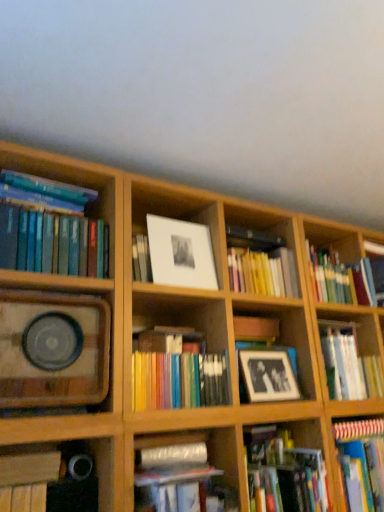
Question: Do you think matte black frame at center, the second shelf viewed from the left, is within yellow matte book at center, which is counted as the 3th book, starting from the right, or outside of it?

Choices:
 (A) inside
 (B) outside

Answer: (B)

Question: Visually, is matte black frame at center, the first shelf positioned from the right, positioned to the left or to the right of yellow matte book at center, which is counted as the 3th book, starting from the right?

Choices:
 (A) right
 (B) left

Answer: (A)

Question: Considering the real-world distances, which object is closest to the black matte picture frame at center, the second picture frame positioned from the left?

Choices:
 (A) wooden speaker at left, marked as the 2th shelf in a right-to-left arrangement
 (B) yellow matte book at center, which is counted as the 3th book, starting from the right
 (C) hardcover book at lower right, marked as the second book in a right-to-left arrangement
 (D) wooden book at lower left, positioned as the 7th book in right-to-left order
 (E) white matte picture frame at center, the first picture frame viewed from the top

Answer: (C)

Question: Estimate the real-world distances between objects in this image. Which object is closer to the white matte photo frame at center, the first book when ordered from right to left?

Choices:
 (A) black matte book at lower left, which is counted as the sixth book, starting from the right
 (B) yellow matte book at center, which is counted as the 3th book, starting from the right
 (C) teal hardcover book at left, the eighth book positioned from the right
 (D) wooden speaker at left, the first shelf positioned from the left
 (E) matte black frame at center, the second shelf viewed from the left

Answer: (E)